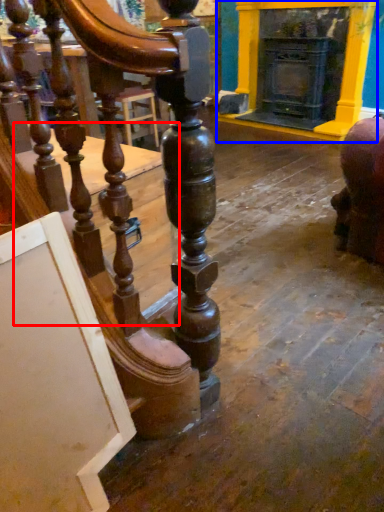
Question: Which object appears farthest to the camera in this image, table (highlighted by a red box) or fireplace (highlighted by a blue box)?

Choices:
 (A) table
 (B) fireplace

Answer: (B)